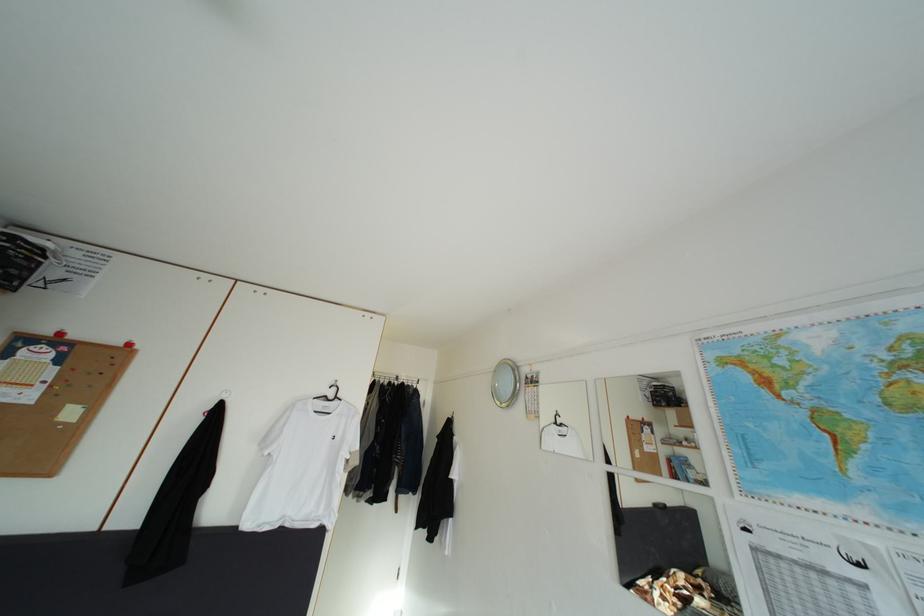
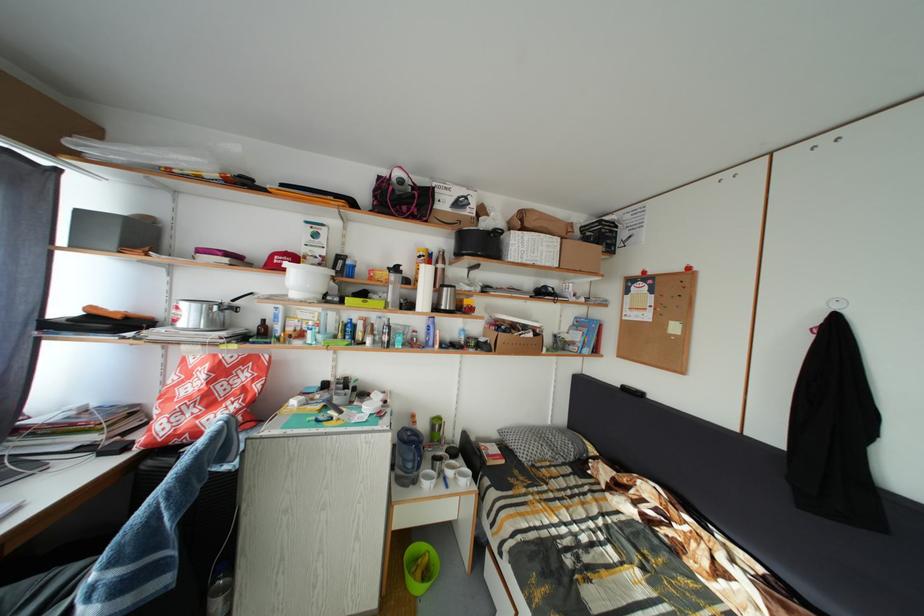
Question: Based on the continuous images, in which direction is the camera rotating? Reply with the corresponding letter.

Choices:
 (A) Left
 (B) Right
 (C) Up
 (D) Down

Answer: (A)